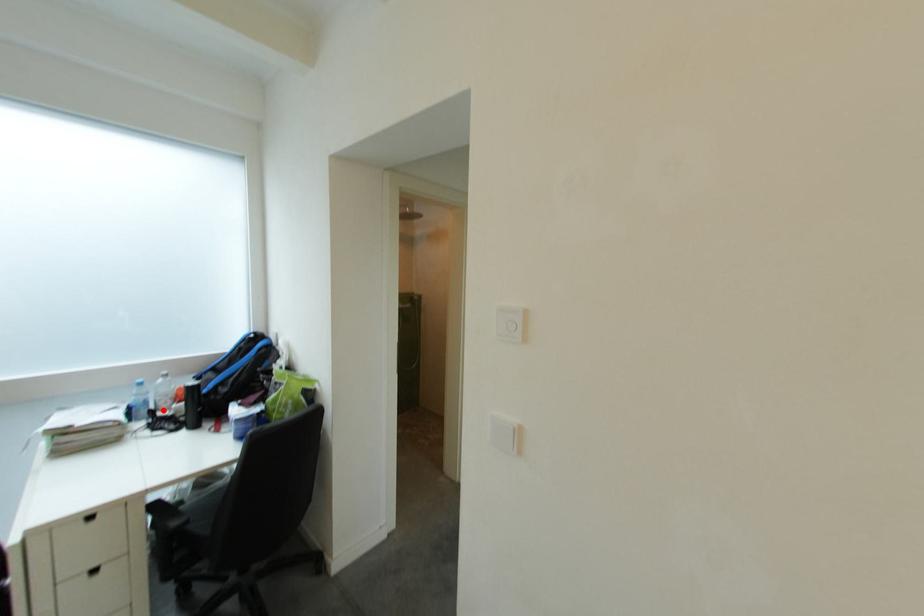
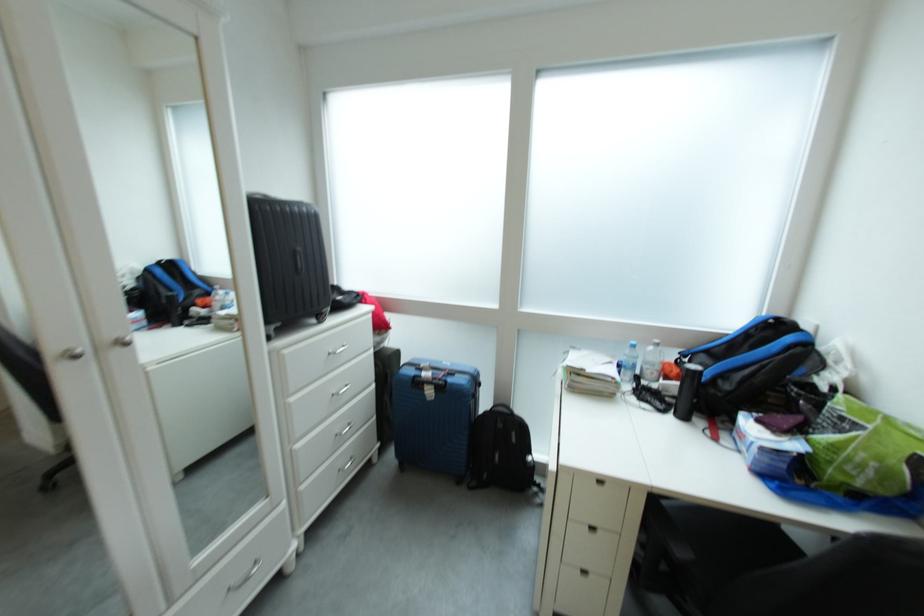
Where in the second image is the point corresponding to the highlighted location from the first image?

(650, 376)